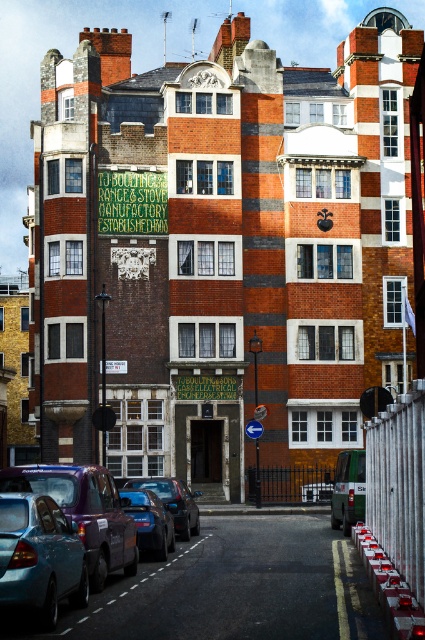
Between point (56, 593) and point (334, 496), which one is positioned behind?

The point (334, 496) is more distant.

Locate an element on the screen. The width and height of the screenshot is (425, 640). matte blue car at lower left is located at coordinates (39, 556).

Which is in front, point (45, 588) or point (159, 531)?

Point (45, 588) is in front.

Is the position of matte blue car at lower left more distant than that of shiny black car at lower left?

No.

Is point (5, 563) farther from viewer compared to point (122, 508)?

No, it is in front of (122, 508).

The height and width of the screenshot is (640, 425). In order to click on matte blue car at lower left in this screenshot , I will do `click(39, 556)`.

Which of these two, shiny black car at lower left or metallic blue car at center, stands taller?

metallic blue car at center

Does point (158, 545) come in front of point (190, 499)?

Yes, it is in front of point (190, 499).

Who is more distant from viewer, (144,506) or (124,486)?

The point (124,486) is behind.

I want to click on shiny black car at lower left, so click(150, 522).